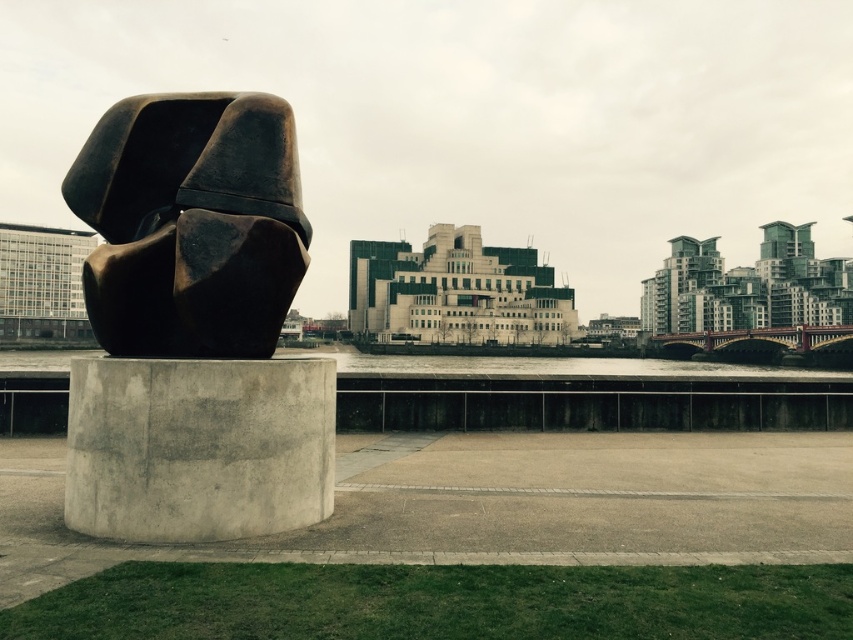
Question: Which point is farther from the camera taking this photo?

Choices:
 (A) (213, 285)
 (B) (161, 440)

Answer: (A)

Question: Can you confirm if bronze sculpture at left is wider than gray concrete at center?

Choices:
 (A) yes
 (B) no

Answer: (A)

Question: Does bronze sculpture at left lie in front of gray concrete at center?

Choices:
 (A) yes
 (B) no

Answer: (B)

Question: Does bronze sculpture at left appear on the right side of gray concrete at center?

Choices:
 (A) no
 (B) yes

Answer: (A)

Question: Which object appears closest to the camera in this image?

Choices:
 (A) gray concrete at center
 (B) bronze sculpture at left

Answer: (A)

Question: Which of the following is the farthest from the observer?

Choices:
 (A) gray concrete at center
 (B) bronze sculpture at left

Answer: (B)